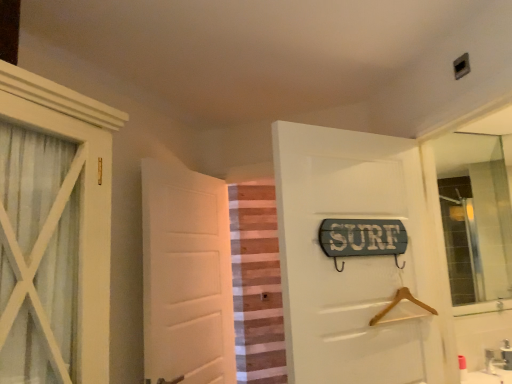
Question: Considering the relative sizes of white matte door at center, placed as the second door when sorted from front to back, and striped fabric curtain at center in the image provided, is white matte door at center, placed as the second door when sorted from front to back, smaller than striped fabric curtain at center?

Choices:
 (A) yes
 (B) no

Answer: (B)

Question: Does white matte door at center, the 1th door in the left-to-right sequence, have a greater height compared to striped fabric curtain at center?

Choices:
 (A) yes
 (B) no

Answer: (B)

Question: Does white matte door at center, the first door in the back-to-front sequence, have a greater width compared to striped fabric curtain at center?

Choices:
 (A) no
 (B) yes

Answer: (B)

Question: Is white matte door at center, the 1th door in the left-to-right sequence, positioned before striped fabric curtain at center?

Choices:
 (A) no
 (B) yes

Answer: (B)

Question: Does white matte door at center, the 1th door in the left-to-right sequence, come behind striped fabric curtain at center?

Choices:
 (A) no
 (B) yes

Answer: (A)

Question: Considering the positions of striped fabric curtain at center and white matte door at center, which is the 2th door from right to left, in the image, is striped fabric curtain at center bigger or smaller than white matte door at center, which is the 2th door from right to left,?

Choices:
 (A) small
 (B) big

Answer: (A)

Question: Which is correct: striped fabric curtain at center is inside white matte door at center, the first door in the back-to-front sequence, or outside of it?

Choices:
 (A) outside
 (B) inside

Answer: (A)

Question: From a real-world perspective, is striped fabric curtain at center physically located above or below white matte door at center, placed as the second door when sorted from front to back?

Choices:
 (A) below
 (B) above

Answer: (A)

Question: Considering the positions of striped fabric curtain at center and white matte door at center, the 1th door in the left-to-right sequence, in the image, is striped fabric curtain at center taller or shorter than white matte door at center, the 1th door in the left-to-right sequence,?

Choices:
 (A) tall
 (B) short

Answer: (A)

Question: From a real-world perspective, is wooden sign at center, which appears as the 2th door when viewed from the left, above or below striped fabric curtain at center?

Choices:
 (A) above
 (B) below

Answer: (A)

Question: Considering their positions, is wooden sign at center, acting as the 2th door starting from the back, located in front of or behind striped fabric curtain at center?

Choices:
 (A) behind
 (B) front

Answer: (B)

Question: Does point (346, 261) appear closer or farther from the camera than point (253, 269)?

Choices:
 (A) farther
 (B) closer

Answer: (B)

Question: Is wooden sign at center, which appears as the 2th door when viewed from the left, to the left or to the right of striped fabric curtain at center in the image?

Choices:
 (A) right
 (B) left

Answer: (A)

Question: Would you say white matte door at center, placed as the second door when sorted from front to back, is inside or outside wooden sign at center, which is the first door in right-to-left order?

Choices:
 (A) inside
 (B) outside

Answer: (B)

Question: Considering the relative positions of white matte door at center, the first door in the back-to-front sequence, and wooden sign at center, the first door from the front, in the image provided, is white matte door at center, the first door in the back-to-front sequence, to the left or to the right of wooden sign at center, the first door from the front,?

Choices:
 (A) left
 (B) right

Answer: (A)